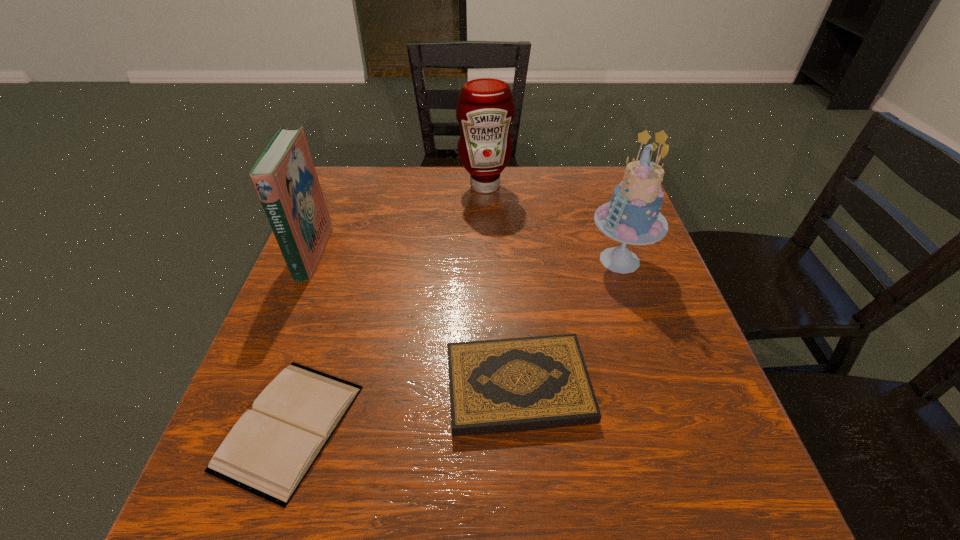
Locate an element on the screen. The image size is (960, 540). vacant space situated 0.140m on the cover of the tallest hardback book is located at coordinates (381, 253).

Locate an element on the screen. free space located on the left of the second tallest hardback book is located at coordinates (385, 387).

The width and height of the screenshot is (960, 540). Identify the location of free region located 0.400m on the right of the shortest hardback book. (590, 427).

Locate an element on the screen. This screenshot has height=540, width=960. object that is at the far edge is located at coordinates [x=485, y=109].

Locate an element on the screen. object at the near edge is located at coordinates (268, 452).

In order to click on object that is at the right edge in this screenshot , I will do `click(632, 217)`.

Locate an element on the screen. object that is positioned at the near left corner is located at coordinates (268, 452).

At what (x,y) coordinates should I click in order to perform the action: click on free location at the far edge. Please return your answer as a coordinate pair (x, y). The height and width of the screenshot is (540, 960). Looking at the image, I should click on (501, 193).

Where is `free region at the near edge`? The height and width of the screenshot is (540, 960). free region at the near edge is located at coordinates (473, 494).

Where is `vacant region at the right edge`? The height and width of the screenshot is (540, 960). vacant region at the right edge is located at coordinates (649, 360).